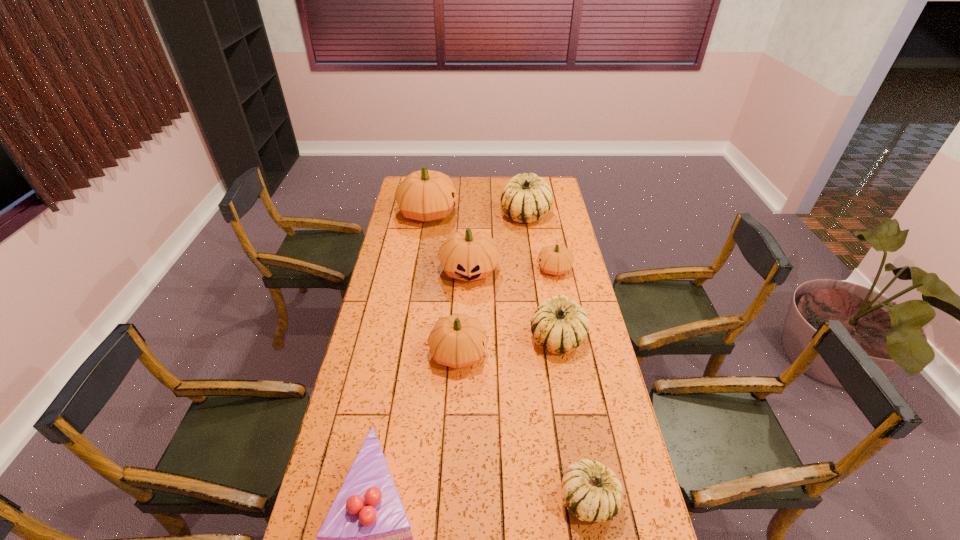
Select which object is the fifth closest to the biggest orange gourd. Please provide its 2D coordinates. Your answer should be formatted as a tuple, i.e. [(x, y)], where the tuple contains the x and y coordinates of a point satisfying the conditions above.

[(458, 340)]

You are a GUI agent. You are given a task and a screenshot of the screen. Output one action in this format:
    pyautogui.click(x=<x>, y=<y>)
    Task: Click on the third closest object relative to the third biggest orange gourd
    This screenshot has width=960, height=540.
    Given the screenshot: What is the action you would take?
    pyautogui.click(x=366, y=539)

Identify which gourd is the third nearest to the second biggest orange gourd. Please provide its 2D coordinates. Your answer should be formatted as a tuple, i.e. [(x, y)], where the tuple contains the x and y coordinates of a point satisfying the conditions above.

[(526, 198)]

Where is `the sixth closest gourd to the farthest orange gourd`? the sixth closest gourd to the farthest orange gourd is located at coordinates (591, 492).

Identify which orange gourd is the closest to the smallest orange gourd. Please provide its 2D coordinates. Your answer should be formatted as a tuple, i.e. [(x, y)], where the tuple contains the x and y coordinates of a point satisfying the conditions above.

[(468, 255)]

Locate an element on the screen. The image size is (960, 540). orange gourd object that ranks as the third closest to the purple cake is located at coordinates (555, 259).

Where is `white gourd object that ranks as the closest to the farthest orange gourd`? white gourd object that ranks as the closest to the farthest orange gourd is located at coordinates (526, 198).

Where is `the second closest white gourd relative to the nearest orange gourd`? The image size is (960, 540). the second closest white gourd relative to the nearest orange gourd is located at coordinates point(591,492).

At what (x,y) coordinates should I click in order to perform the action: click on vacant area in the image that satisfies the following two spatial constraints: 1. on the back side of the farthest white gourd; 2. on the side of the biggest orange gourd with the carved face. Please return your answer as a coordinate pair (x, y). This screenshot has width=960, height=540. Looking at the image, I should click on (525, 213).